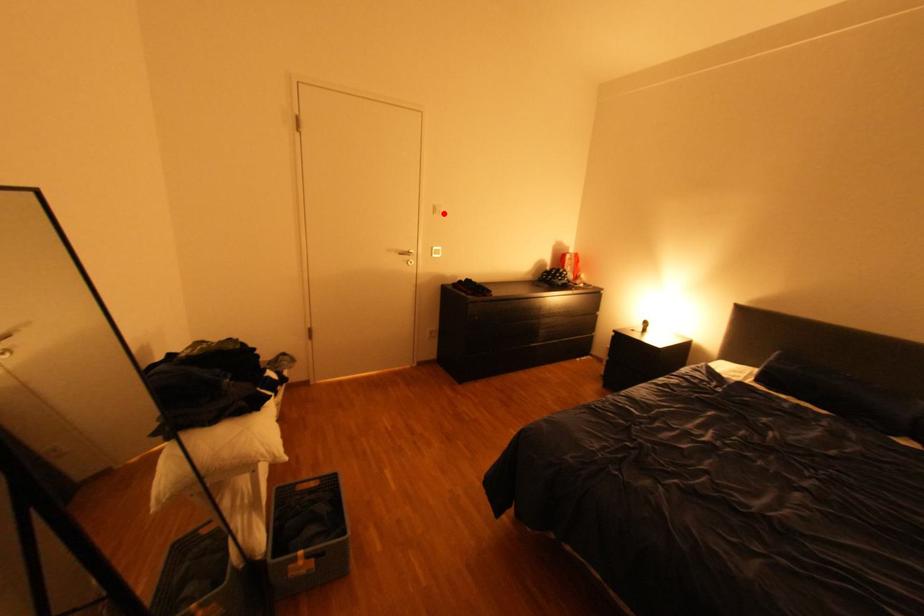
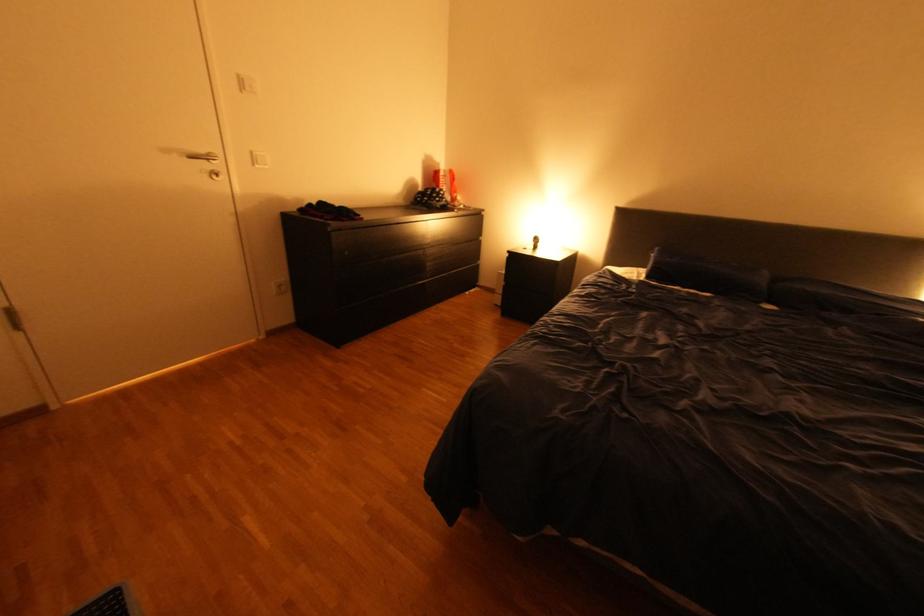
Locate, in the second image, the point that corresponds to the highlighted location in the first image.

(251, 91)